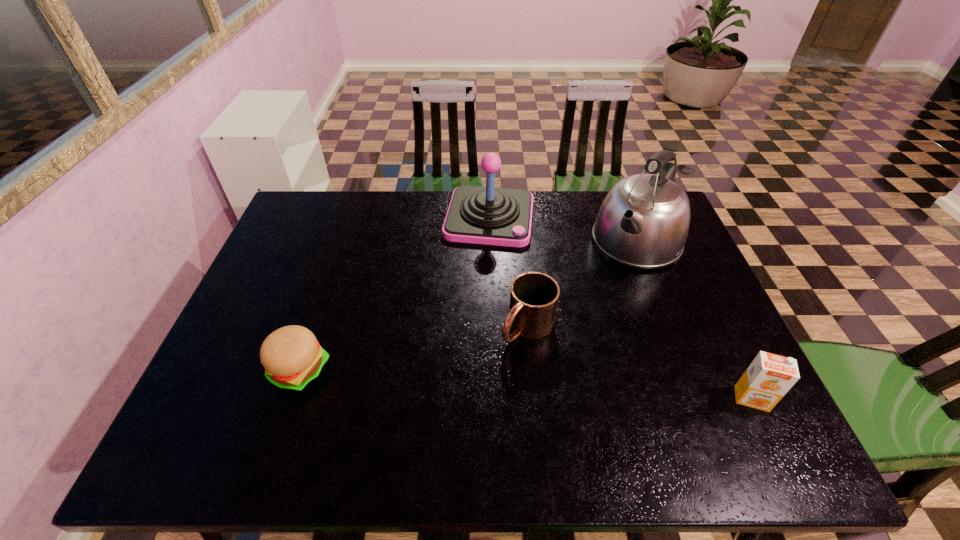
At what (x,y) coordinates should I click in order to perform the action: click on vacant area that lies between the joystick and the leftmost object. Please return your answer as a coordinate pair (x, y). The height and width of the screenshot is (540, 960). Looking at the image, I should click on (395, 294).

Select which object appears as the third closest to the joystick. Please provide its 2D coordinates. Your answer should be formatted as a tuple, i.e. [(x, y)], where the tuple contains the x and y coordinates of a point satisfying the conditions above.

[(292, 357)]

You are a GUI agent. You are given a task and a screenshot of the screen. Output one action in this format:
    pyautogui.click(x=<x>, y=<y>)
    Task: Click on the object that ranks as the third closest to the second tallest object
    This screenshot has width=960, height=540.
    Given the screenshot: What is the action you would take?
    pyautogui.click(x=292, y=357)

You are a GUI agent. You are given a task and a screenshot of the screen. Output one action in this format:
    pyautogui.click(x=<x>, y=<y>)
    Task: Click on the vacant region that satisfies the following two spatial constraints: 1. on the back side of the tallest object; 2. on the left side of the hamburger
    This screenshot has height=540, width=960.
    Given the screenshot: What is the action you would take?
    pyautogui.click(x=344, y=242)